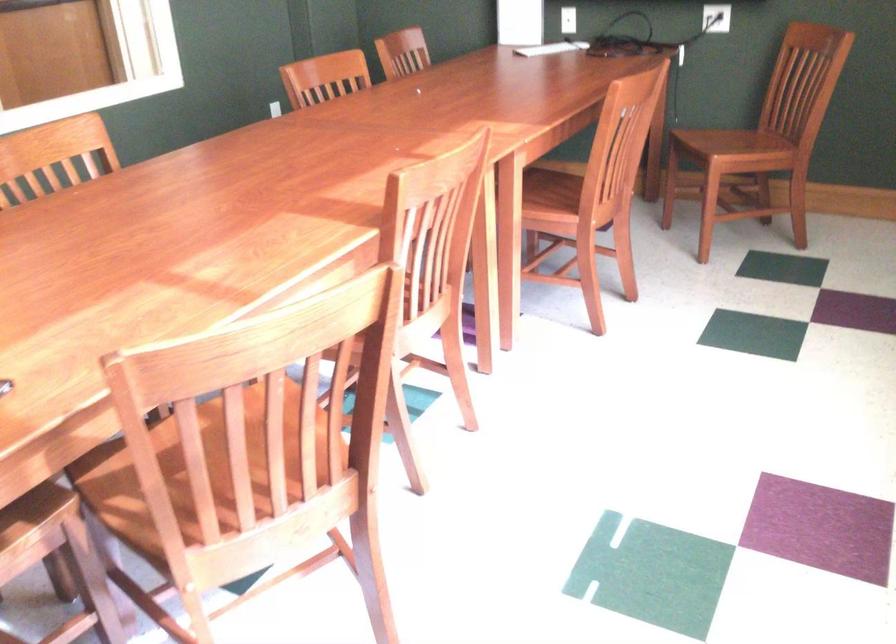
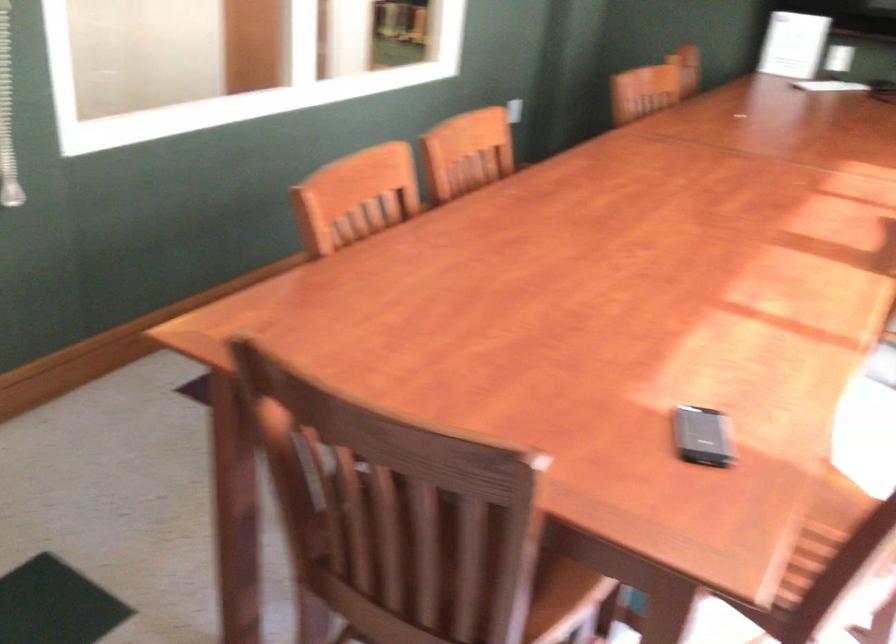
Question: The camera is either moving clockwise (left) or counter-clockwise (right) around the object. The first image is from the beginning of the video and the second image is from the end. Is the camera moving left or right when shooting the video?

Choices:
 (A) Left
 (B) Right

Answer: (B)